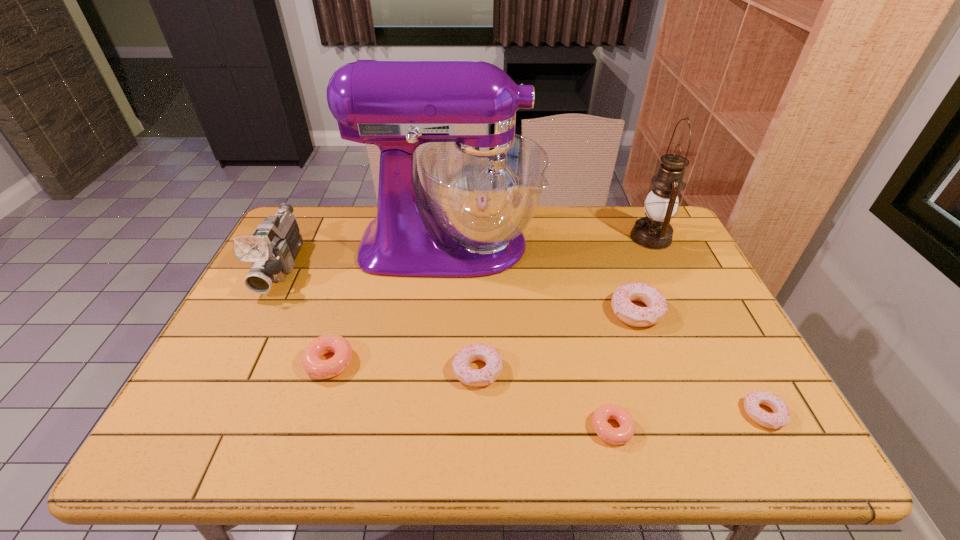
At what (x,y) coordinates should I click in order to perform the action: click on object at the far left corner. Please return your answer as a coordinate pair (x, y). Looking at the image, I should click on point(271,250).

Find the location of `object that is positioned at the far right corner`. object that is positioned at the far right corner is located at coordinates (654, 231).

At what (x,y) coordinates should I click in order to perform the action: click on object at the near right corner. Please return your answer as a coordinate pair (x, y). Image resolution: width=960 pixels, height=540 pixels. Looking at the image, I should click on (781, 416).

In the image, there is a desktop. At what (x,y) coordinates should I click in order to perform the action: click on vacant area at the near edge. Please return your answer as a coordinate pair (x, y). Looking at the image, I should click on (582, 443).

In the image, there is a desktop. At what (x,y) coordinates should I click in order to perform the action: click on vacant space at the left edge. Please return your answer as a coordinate pair (x, y). The height and width of the screenshot is (540, 960). Looking at the image, I should click on (308, 274).

You are a GUI agent. You are given a task and a screenshot of the screen. Output one action in this format:
    pyautogui.click(x=<x>, y=<y>)
    Task: Click on the vacant space at the right edge of the desktop
    
    Given the screenshot: What is the action you would take?
    (714, 357)

You are a GUI agent. You are given a task and a screenshot of the screen. Output one action in this format:
    pyautogui.click(x=<x>, y=<y>)
    Task: Click on the free space at the far left corner of the desktop
    This screenshot has height=540, width=960.
    Given the screenshot: What is the action you would take?
    pyautogui.click(x=298, y=213)

Locate an element on the screen. unoccupied area between the tallest object and the oil lamp is located at coordinates (550, 241).

At what (x,y) coordinates should I click in order to perform the action: click on vacant space that is in between the second farthest white doughnut and the nearer pink doughnut. Please return your answer as a coordinate pair (x, y). The width and height of the screenshot is (960, 540). Looking at the image, I should click on (544, 399).

Where is `free space that is in between the leftmost doughnut and the purple mixer`? The width and height of the screenshot is (960, 540). free space that is in between the leftmost doughnut and the purple mixer is located at coordinates (390, 303).